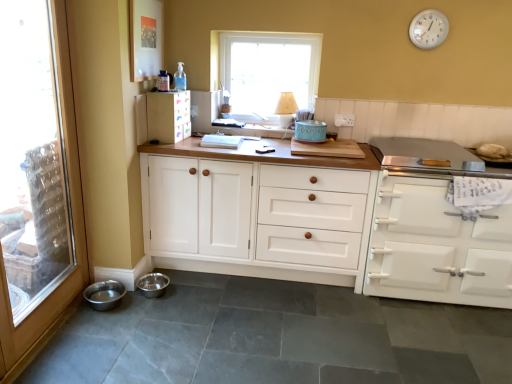
Question: From a real-world perspective, does matte white cabinet at upper left, the first cabinetry in the left-to-right sequence, sit lower than white plastic clock at upper right?

Choices:
 (A) no
 (B) yes

Answer: (B)

Question: Can you see matte white cabinet at upper left, positioned as the third cabinetry in right-to-left order, touching white plastic clock at upper right?

Choices:
 (A) no
 (B) yes

Answer: (A)

Question: Is matte white cabinet at upper left, positioned as the third cabinetry in right-to-left order, turned away from white plastic clock at upper right?

Choices:
 (A) yes
 (B) no

Answer: (B)

Question: From the image's perspective, is matte white cabinet at upper left, the first cabinetry in the left-to-right sequence, above white plastic clock at upper right?

Choices:
 (A) no
 (B) yes

Answer: (A)

Question: Would you say matte white cabinet at upper left, the first cabinetry in the left-to-right sequence, is outside white plastic clock at upper right?

Choices:
 (A) yes
 (B) no

Answer: (A)

Question: Looking at the image, does white matte oven at right, arranged as the 1th cabinetry when viewed from the right, seem bigger or smaller compared to matte white cabinet at upper left, positioned as the third cabinetry in right-to-left order?

Choices:
 (A) big
 (B) small

Answer: (A)

Question: Is white matte oven at right, arranged as the 1th cabinetry when viewed from the right, wider or thinner than matte white cabinet at upper left, the first cabinetry in the left-to-right sequence?

Choices:
 (A) thin
 (B) wide

Answer: (B)

Question: From a real-world perspective, is white matte oven at right, marked as the third cabinetry in a left-to-right arrangement, positioned above or below matte white cabinet at upper left, positioned as the third cabinetry in right-to-left order?

Choices:
 (A) above
 (B) below

Answer: (B)

Question: Would you say white matte oven at right, marked as the third cabinetry in a left-to-right arrangement, is to the left or to the right of matte white cabinet at upper left, positioned as the third cabinetry in right-to-left order, in the picture?

Choices:
 (A) right
 (B) left

Answer: (A)

Question: From a real-world perspective, is white frame window at upper center physically located above or below transparent glass door at left?

Choices:
 (A) below
 (B) above

Answer: (B)

Question: In terms of height, does white frame window at upper center look taller or shorter compared to transparent glass door at left?

Choices:
 (A) short
 (B) tall

Answer: (A)

Question: Would you say white frame window at upper center is inside or outside transparent glass door at left?

Choices:
 (A) inside
 (B) outside

Answer: (B)

Question: In terms of width, does white frame window at upper center look wider or thinner when compared to transparent glass door at left?

Choices:
 (A) thin
 (B) wide

Answer: (A)

Question: Considering the positions of matte white cabinet at upper left, the first cabinetry in the left-to-right sequence, and wooden lampshade at upper center in the image, is matte white cabinet at upper left, the first cabinetry in the left-to-right sequence, wider or thinner than wooden lampshade at upper center?

Choices:
 (A) wide
 (B) thin

Answer: (B)

Question: Relative to wooden lampshade at upper center, is matte white cabinet at upper left, positioned as the third cabinetry in right-to-left order, in front or behind?

Choices:
 (A) front
 (B) behind

Answer: (A)